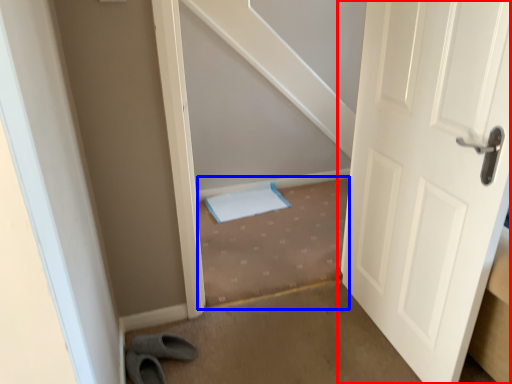
Question: Which of the following is the closest to the observer, door (highlighted by a red box) or stairwell (highlighted by a blue box)?

Choices:
 (A) door
 (B) stairwell

Answer: (A)